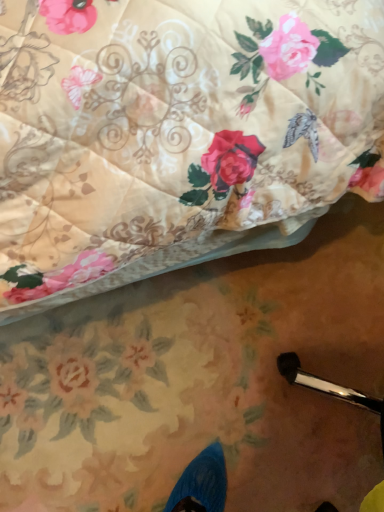
What do you see at coordinates (176, 134) in the screenshot? Image resolution: width=384 pixels, height=512 pixels. I see `floral fabric bed at center` at bounding box center [176, 134].

Locate an element on the screen. floral fabric bed at center is located at coordinates (176, 134).

This screenshot has width=384, height=512. I want to click on floral fabric bed at center, so click(x=176, y=134).